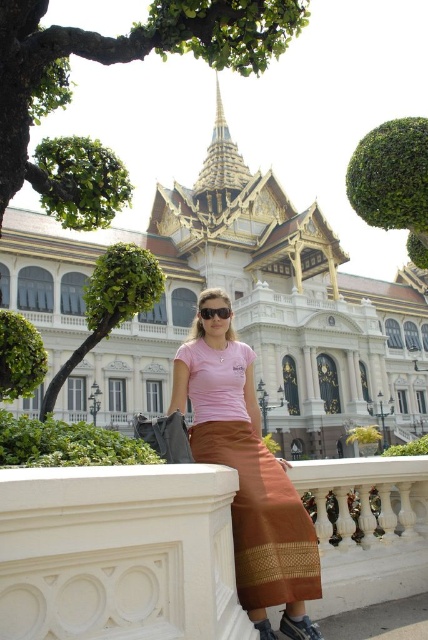
You are a photographer trying to capture the white marble ledge at lower center and the pink fabric skirt at center in the same frame. Which object will appear larger in the photo?

The white marble ledge at lower center will appear larger in the photo because it is closer to the viewer than the pink fabric skirt at center.

You are taking a photo of the gold metallic palace at center. Where should you position your camera to capture the palace in the center of the frame?

The gold metallic palace at center is located at the coordinates (234, 307), so positioning the camera to align with these coordinates will center the palace in the frame.

Based on the scene, if you were standing at the position of the woman, which object would appear closer to your eyes, the gold metallic palace at center or the white marble ledge at lower center?

The white marble ledge at lower center appears closer to your eyes because it is positioned at lower center, while the gold metallic palace at center is much taller and further away.